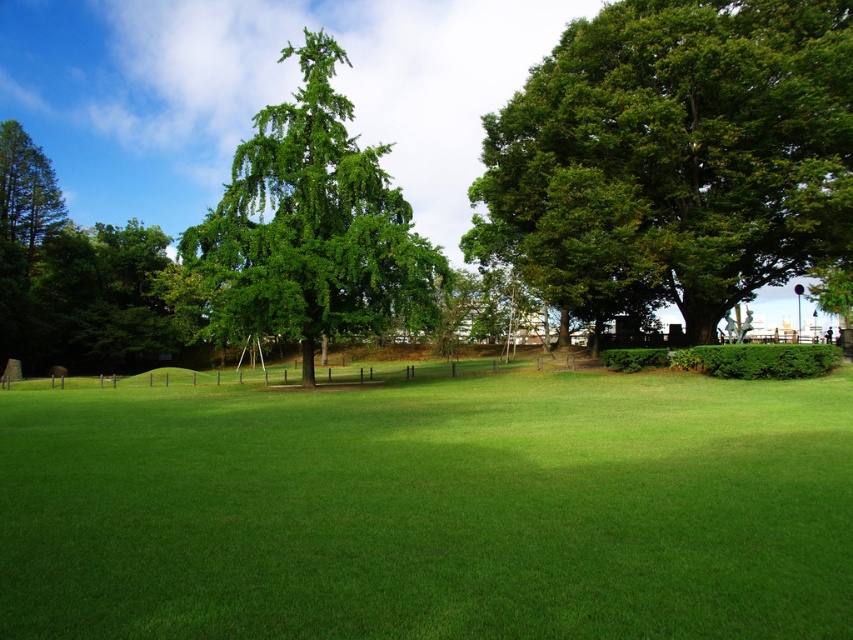
Question: Which point appears closest to the camera in this image?

Choices:
 (A) (607, 154)
 (B) (85, 513)

Answer: (B)

Question: Where is green leafy tree at right located in relation to green leafy tree at center in the image?

Choices:
 (A) above
 (B) below

Answer: (B)

Question: Among these points, which one is farthest from the camera?

Choices:
 (A) (257, 332)
 (B) (772, 262)

Answer: (B)

Question: Estimate the real-world distances between objects in this image. Which object is closer to the green leafy tree at center?

Choices:
 (A) green grass at center
 (B) green leafy tree at right

Answer: (B)

Question: Is the position of green grass at center more distant than that of green leafy tree at center?

Choices:
 (A) yes
 (B) no

Answer: (B)

Question: Can you confirm if green leafy tree at right is bigger than green leafy tree at center?

Choices:
 (A) yes
 (B) no

Answer: (B)